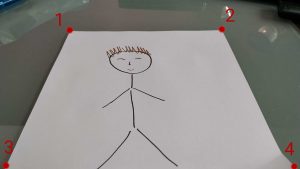
Locate an element on the screen. white table is located at coordinates click(x=278, y=88).